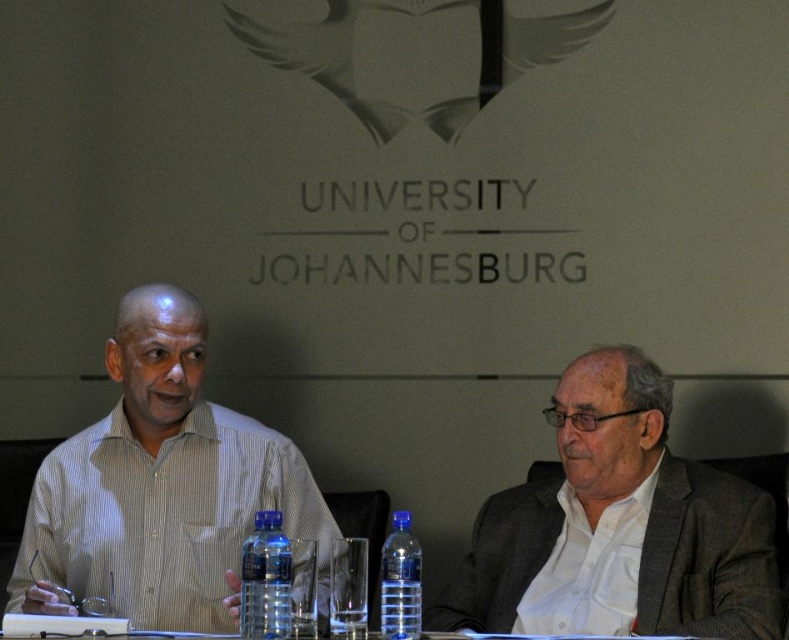
You are organizing a meeting in the University of Johannesburg conference room and notice two items at the center of the table. Which item takes up more space on the table between the white textured shirt at center and the transparent plastic bottle at center?

The white textured shirt at center is larger in size than the transparent plastic bottle at center, so the white textured shirt at center takes up more space on the table.

You are an observer looking at the scene. There is a white striped shirt at center and a clear plastic bottle at center. Which object is positioned higher in the image?

The white striped shirt at center is above the clear plastic bottle at center, so the white striped shirt at center is positioned higher.